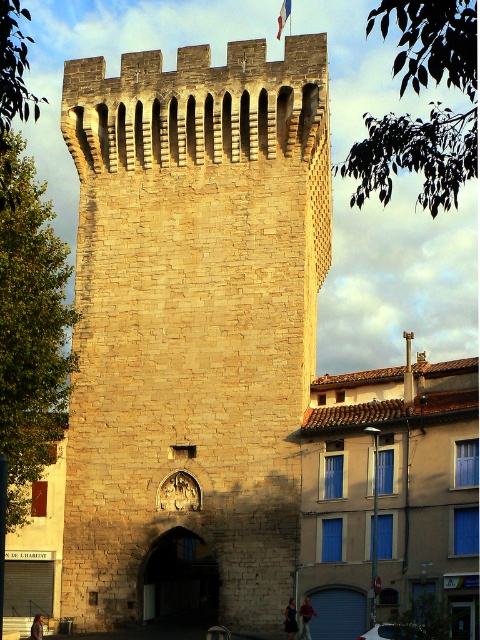
Question: Can you confirm if stone tower at center is positioned to the left of smooth gray door at center?

Choices:
 (A) no
 (B) yes

Answer: (B)

Question: Which object appears farthest from the camera in this image?

Choices:
 (A) stone tower at center
 (B) blue fabric flag at upper center
 (C) smooth gray door at center

Answer: (B)

Question: Among these points, which one is nearest to the camera?

Choices:
 (A) (288, 6)
 (B) (295, 340)
 (C) (206, 563)
 (D) (356, 589)

Answer: (D)

Question: Among these points, which one is nearest to the camera?

Choices:
 (A) (357, 595)
 (B) (289, 4)

Answer: (A)

Question: In this image, where is stone tower at center located relative to dark stone archway at center?

Choices:
 (A) below
 (B) above

Answer: (B)

Question: Observing the image, what is the correct spatial positioning of stone tower at center in reference to blue fabric flag at upper center?

Choices:
 (A) left
 (B) right

Answer: (A)